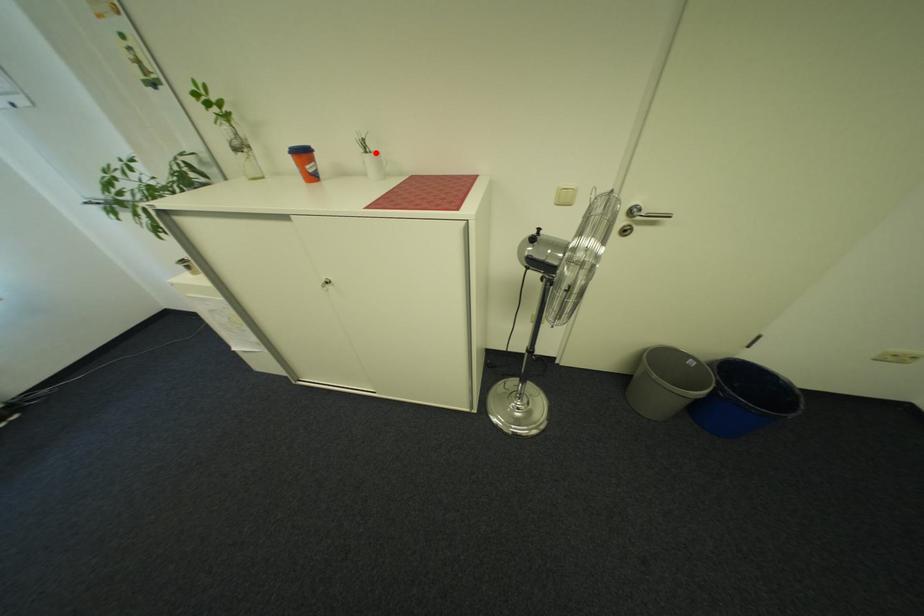
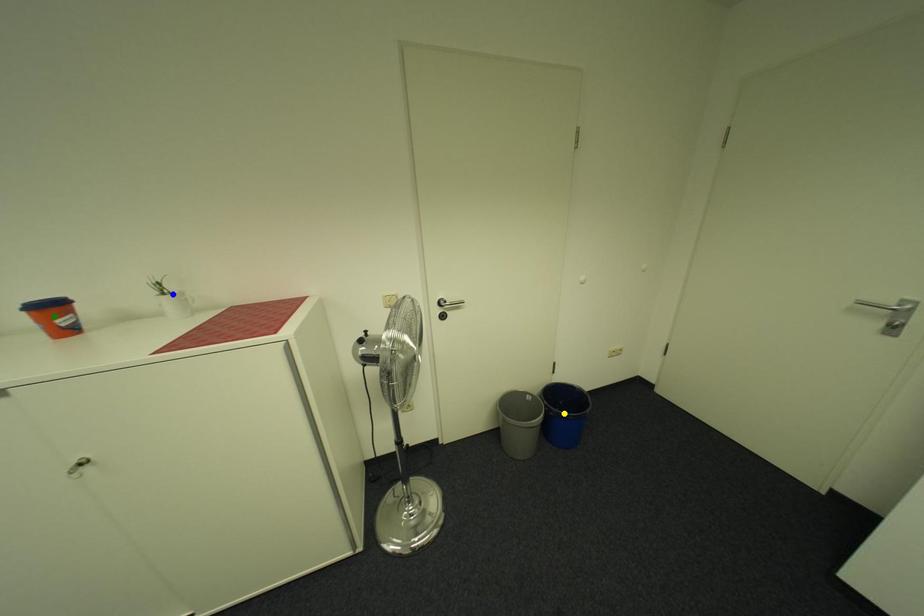
Question: I am providing you with two images of the same scene from different viewpoints. A red point is marked on the first image. You are given multiple points on the second image. Can you choose the point in image 2 that corresponds to the point in image 1?

Choices:
 (A) yellow point
 (B) blue point
 (C) green point

Answer: (B)